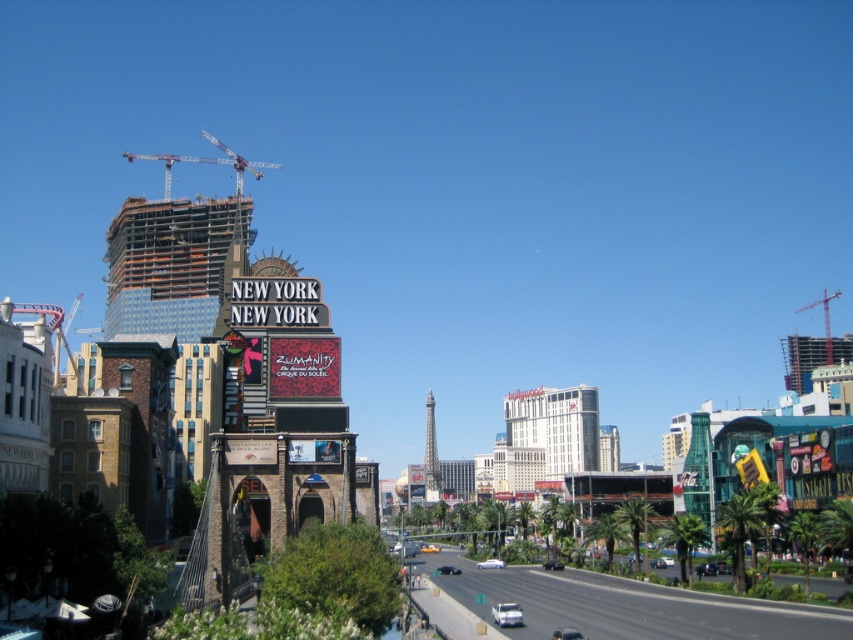
Is concrete construction site at lower center wider than metallic red crane at upper right?

No.

Does concrete construction site at lower center lie behind metallic red crane at upper right?

No.

Identify the location of concrete construction site at lower center. Image resolution: width=853 pixels, height=640 pixels. [x=624, y=605].

Does metallic construction crane at upper left come behind metallic red crane at upper right?

No, metallic construction crane at upper left is closer to the viewer.

Who is more distant from viewer, [235,182] or [804,305]?

The point [804,305] is behind.

Who is more forward, [173,154] or [830,362]?

Point [830,362] is in front.

Locate an element on the screen. metallic construction crane at upper left is located at coordinates (207, 163).

Which is in front, point (833, 636) or point (222, 161)?

Point (833, 636) is more forward.

Can you confirm if concrete construction site at lower center is positioned to the right of metallic construction crane at upper left?

Correct, you'll find concrete construction site at lower center to the right of metallic construction crane at upper left.

Does point (721, 612) lie behind point (206, 132)?

That is False.

Identify the location of concrete construction site at lower center. (x=624, y=605).